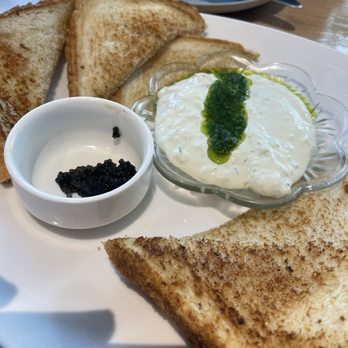
This screenshot has height=348, width=348. I want to click on toast on lower right side of plate, so click(284, 278), click(321, 263).